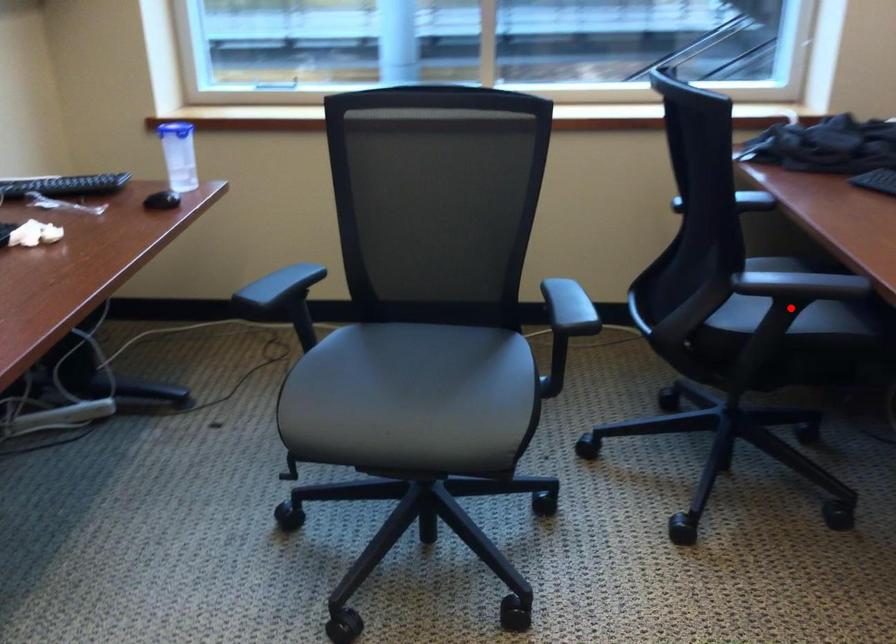
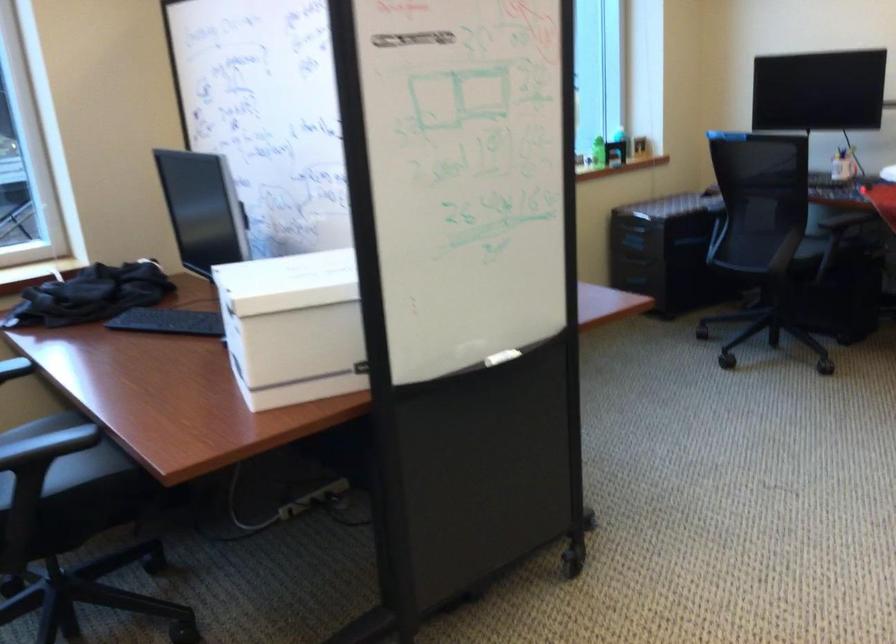
Locate, in the second image, the point that corresponds to the highlighted location in the first image.

(65, 464)